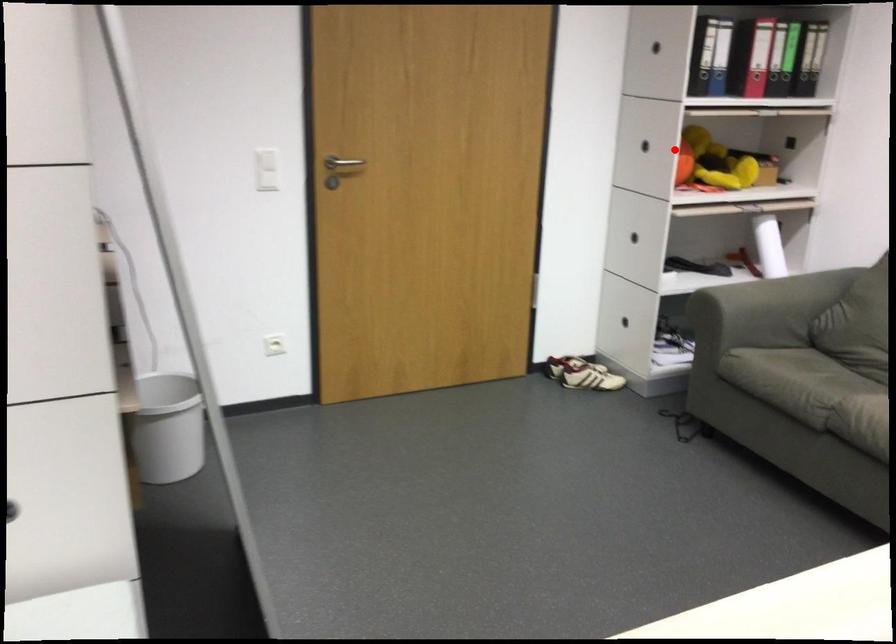
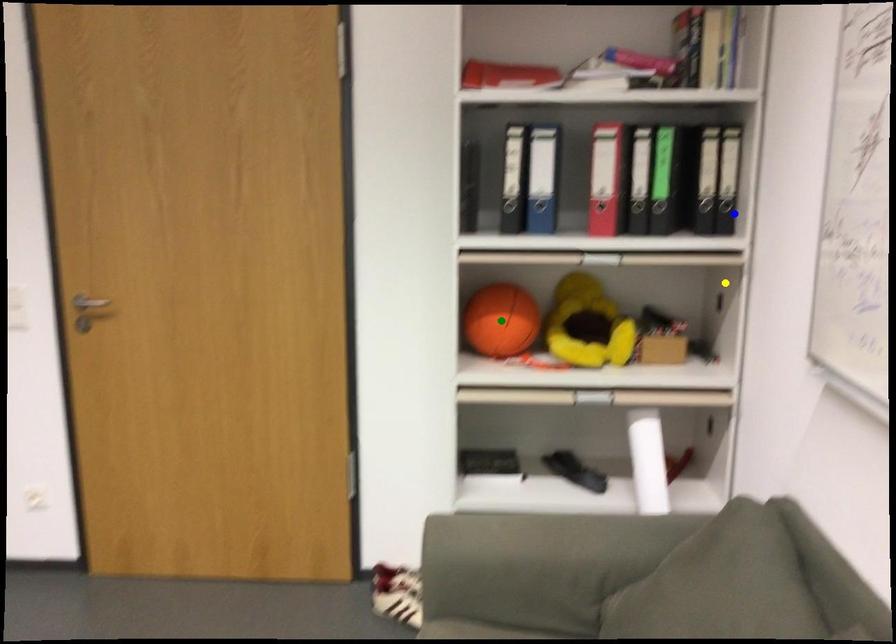
Question: I am providing you with two images of the same scene from different viewpoints. A red point is marked on the first image. You are given multiple points on the second image. Which point in image 2 represents the same 3d spot as the red point in image 1?

Choices:
 (A) yellow point
 (B) green point
 (C) blue point

Answer: (B)